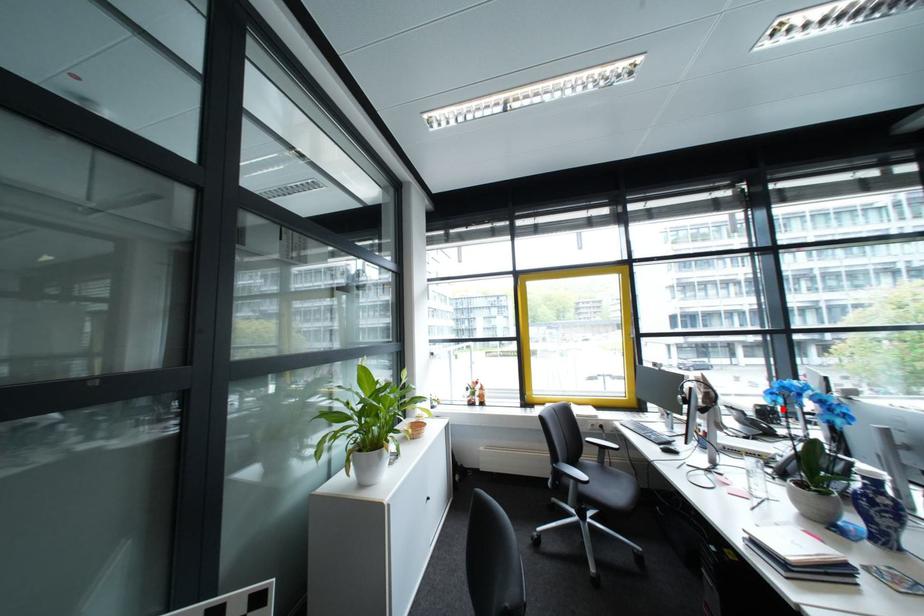
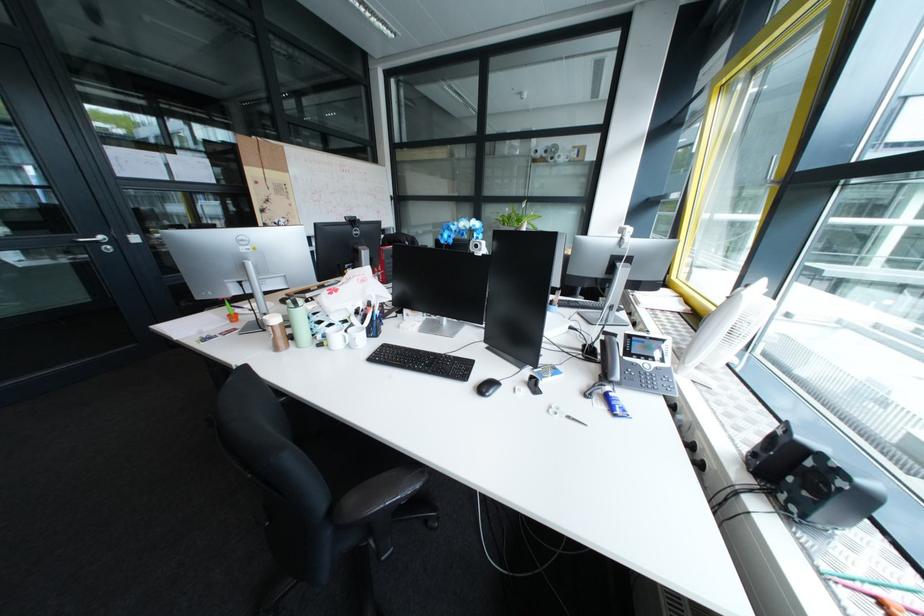
Locate, in the second image, the point that corresponds to the highlighted location in the first image.

(823, 464)